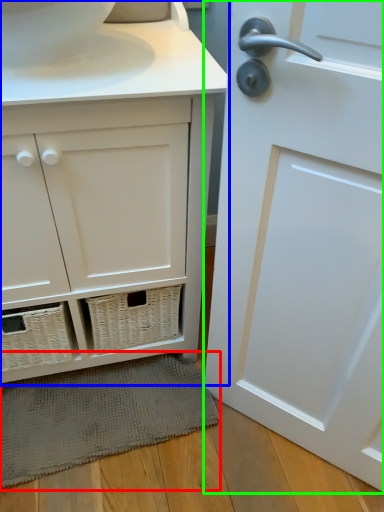
Question: Considering the real-world distances, which object is closest to bath mat (highlighted by a red box)? bathroom cabinet (highlighted by a blue box) or door (highlighted by a green box).

Choices:
 (A) bathroom cabinet
 (B) door

Answer: (A)